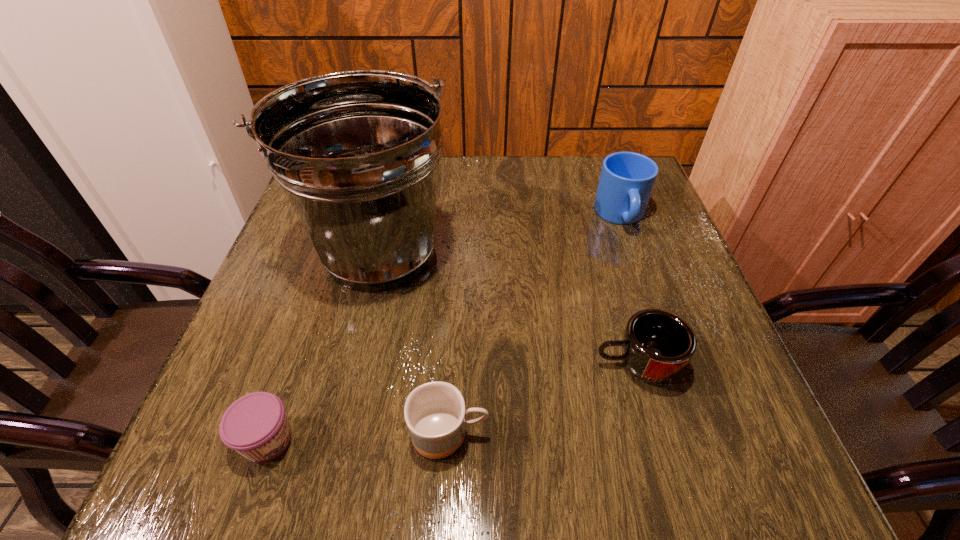
The image size is (960, 540). What are the coordinates of `bucket` in the screenshot? It's located at (357, 153).

What are the coordinates of `the tallest mug` in the screenshot? It's located at coord(627,179).

Locate an element on the screen. the fourth shortest object is located at coordinates (627, 179).

The image size is (960, 540). Identify the location of the third nearest object. (657, 344).

You are a GUI agent. You are given a task and a screenshot of the screen. Output one action in this format:
    pyautogui.click(x=<x>, y=<y>)
    Task: Click on the leftmost mug
    The height and width of the screenshot is (540, 960).
    Given the screenshot: What is the action you would take?
    pyautogui.click(x=435, y=414)

You are a GUI agent. You are given a task and a screenshot of the screen. Output one action in this format:
    pyautogui.click(x=<x>, y=<y>)
    Task: Click on the jam
    The image size is (960, 540).
    Given the screenshot: What is the action you would take?
    pyautogui.click(x=256, y=426)

The image size is (960, 540). I want to click on free region located on the right of the tallest object, so click(x=494, y=253).

Locate an element on the screen. free space located 0.130m on the side of the tallest mug with the handle is located at coordinates (643, 278).

Where is `vacant space positioned on the side of the second nearest mug with the handle`? Image resolution: width=960 pixels, height=540 pixels. vacant space positioned on the side of the second nearest mug with the handle is located at coordinates (456, 364).

You are a GUI agent. You are given a task and a screenshot of the screen. Output one action in this format:
    pyautogui.click(x=<x>, y=<y>)
    Task: Click on the vacant space located on the side of the second nearest mug with the handle
    The image size is (960, 540).
    Given the screenshot: What is the action you would take?
    pyautogui.click(x=384, y=364)